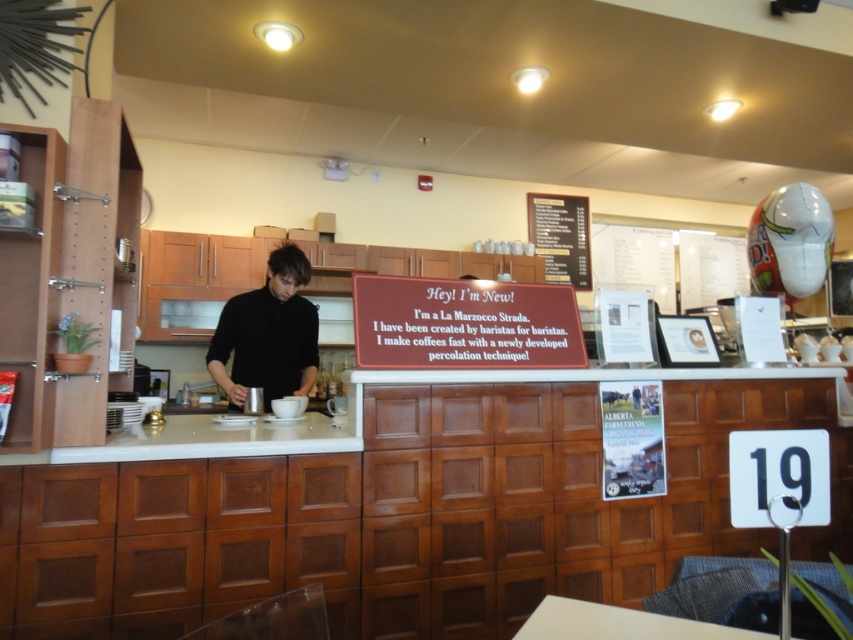
Which of these two, white laminate counter at center or white paper menu at upper right, stands taller?

white paper menu at upper right

Is white laminate counter at center further to the viewer compared to white paper menu at upper right?

No, white laminate counter at center is closer to the viewer.

What do you see at coordinates (204, 442) in the screenshot?
I see `white laminate counter at center` at bounding box center [204, 442].

At what (x,y) coordinates should I click in order to perform the action: click on white laminate counter at center. Please return your answer as a coordinate pair (x, y). Looking at the image, I should click on (204, 442).

Measure the distance between black matte shirt at center and white paper menu at upper right.

3.22 meters

What do you see at coordinates (268, 333) in the screenshot? The height and width of the screenshot is (640, 853). I see `black matte shirt at center` at bounding box center [268, 333].

The width and height of the screenshot is (853, 640). In order to click on black matte shirt at center in this screenshot , I will do `click(268, 333)`.

Who is taller, black matte shirt at center or white laminate counter at center?

black matte shirt at center

Is point (256, 372) positioned behind point (140, 426)?

Yes, it is.

Who is more distant from viewer, (289, 304) or (196, 413)?

Positioned behind is point (196, 413).

The height and width of the screenshot is (640, 853). I want to click on black matte shirt at center, so click(x=268, y=333).